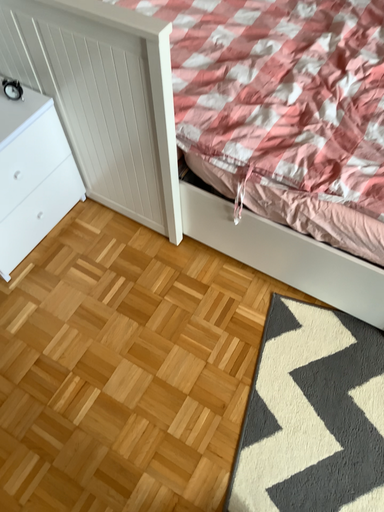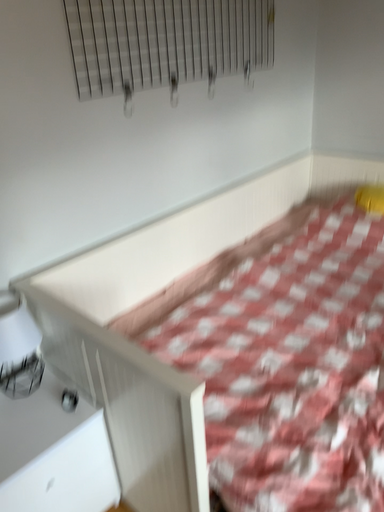
Question: Which way did the camera rotate in the video?

Choices:
 (A) rotated right
 (B) rotated left

Answer: (B)